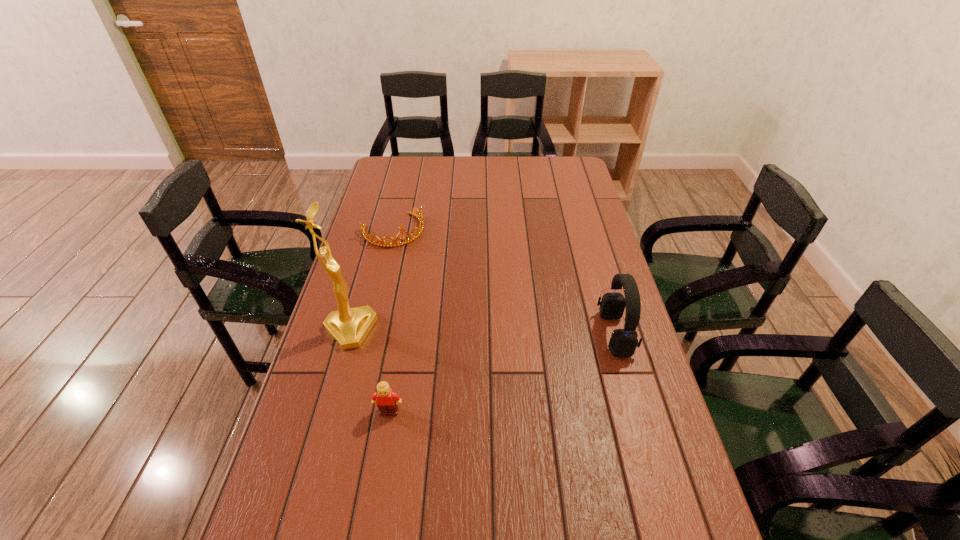
Locate an element on the screen. the third tallest object is located at coordinates (387, 400).

Locate an element on the screen. This screenshot has height=540, width=960. Lego is located at coordinates (387, 400).

At what (x,y) coordinates should I click in order to perform the action: click on headset. Please return your answer as a coordinate pair (x, y). Looking at the image, I should click on (623, 342).

Where is `the third shortest object`? Image resolution: width=960 pixels, height=540 pixels. the third shortest object is located at coordinates (623, 342).

The height and width of the screenshot is (540, 960). In order to click on award in this screenshot , I will do `click(348, 326)`.

Where is `tiara`? tiara is located at coordinates (383, 243).

Where is `the shortest object`? the shortest object is located at coordinates (383, 243).

I want to click on blank space located 0.270m on the face of the nearest object, so click(369, 537).

Locate an element on the screen. The height and width of the screenshot is (540, 960). free spot located 0.060m on the headband of the headset is located at coordinates (580, 334).

Find the location of a particular element. vacant space situated on the headband of the headset is located at coordinates (559, 334).